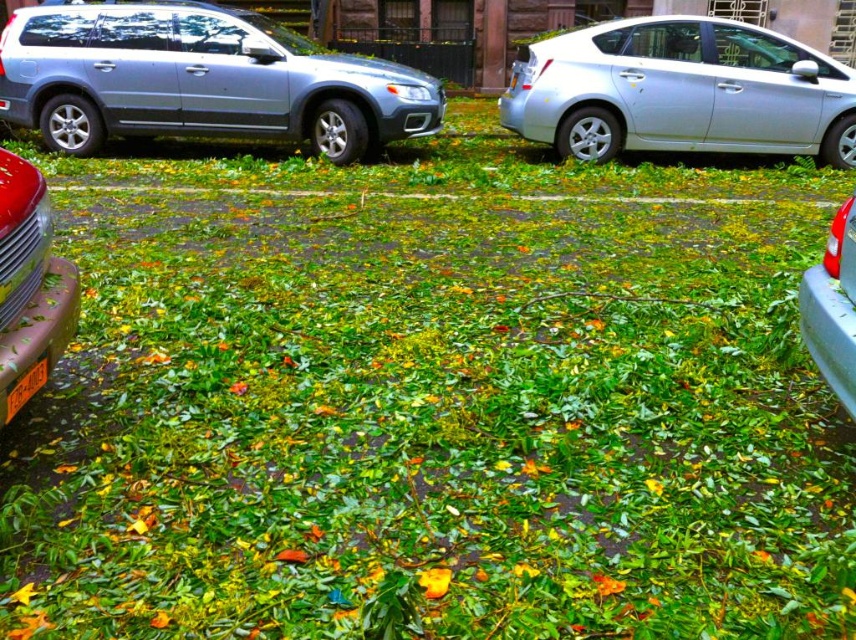
Question: Is satin silver sedan at right further to camera compared to metallic red car at left?

Choices:
 (A) yes
 (B) no

Answer: (A)

Question: From the image, what is the correct spatial relationship of satin silver sedan at right in relation to metallic red car at left?

Choices:
 (A) above
 (B) below

Answer: (A)

Question: Among these points, which one is nearest to the camera?

Choices:
 (A) (557, 122)
 (B) (15, 33)
 (C) (849, 348)

Answer: (C)

Question: Which of these objects is positioned farthest from the satin silver sedan at right?

Choices:
 (A) metallic red car at left
 (B) orange plastic license plate at lower left
 (C) metallic silver sedan at right

Answer: (B)

Question: Estimate the real-world distances between objects in this image. Which object is farther from the orange plastic license plate at lower left?

Choices:
 (A) satin silver suv at left
 (B) satin silver sedan at right
 (C) metallic red car at left

Answer: (B)

Question: Is satin silver sedan at right behind orange plastic license plate at lower left?

Choices:
 (A) yes
 (B) no

Answer: (A)